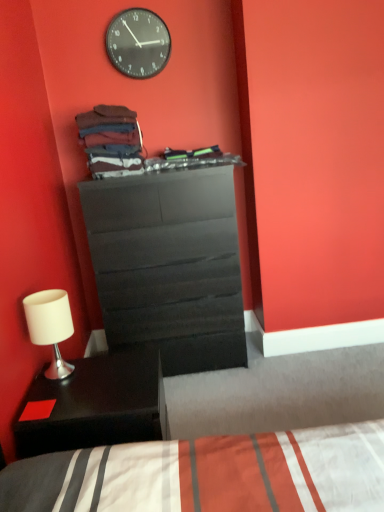
The height and width of the screenshot is (512, 384). In order to click on blank area beneath white matte table lamp at lower left (from a real-world perspective) in this screenshot , I will do `click(62, 371)`.